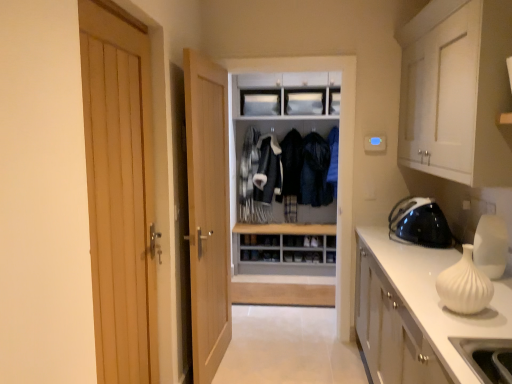
Question: Is white matte cabinet at upper right, which is counted as the 1th cabinetry, starting from the top, in front of or behind light wood door at center, which is the first door from right to left, in the image?

Choices:
 (A) behind
 (B) front

Answer: (B)

Question: Do you think white matte cabinet at upper right, which is counted as the 1th cabinetry, starting from the top, is within light wood door at center, which is the 1th door in back-to-front order, or outside of it?

Choices:
 (A) inside
 (B) outside

Answer: (B)

Question: Considering the real-world distances, which object is farthest from the wooden door at left, marked as the first door in a front-to-back arrangement?

Choices:
 (A) white glossy cabinet at right, the first cabinetry when ordered from bottom to top
 (B) white matte vase at right
 (C) gray matte dresser at center
 (D) white matte cabinet at upper right, the second cabinetry from the bottom
 (E) black glossy iron at right, the 2th appliance viewed from the front

Answer: (E)

Question: Which object is positioned farthest from the white matte vase at right?

Choices:
 (A) white glossy vase at right, acting as the first appliance starting from the front
 (B) light wood door at center, which is the 1th door in back-to-front order
 (C) gray matte dresser at center
 (D) black glossy iron at right, the 2th appliance viewed from the front
 (E) dark blue leather jacket at center, marked as the first clothing in a right-to-left arrangement

Answer: (E)